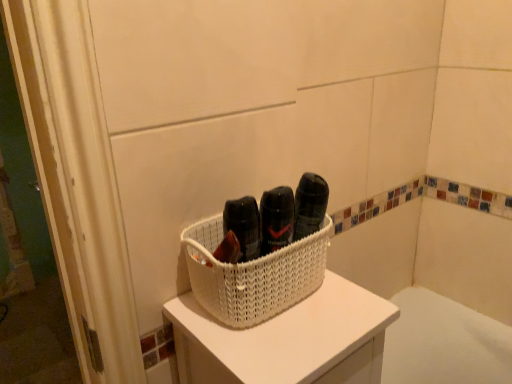
The height and width of the screenshot is (384, 512). What are the coordinates of `white woven basket at center` in the screenshot? It's located at (287, 340).

Describe the element at coordinates (287, 340) in the screenshot. I see `white woven basket at center` at that location.

Measure the distance between white woven basket at center and camera.

white woven basket at center and camera are 20.63 inches apart.

This screenshot has height=384, width=512. Identify the location of white woven basket at center. (253, 274).

Image resolution: width=512 pixels, height=384 pixels. Describe the element at coordinates (253, 274) in the screenshot. I see `white woven basket at center` at that location.

Find the location of a particular element. The width and height of the screenshot is (512, 384). white woven basket at center is located at coordinates (287, 340).

Is white woven basket at center to the right of white woven basket at center from the viewer's perspective?

Correct, you'll find white woven basket at center to the right of white woven basket at center.

Which object is more forward, white woven basket at center or white woven basket at center?

white woven basket at center is closer to the camera.

Which is in front, point (265, 359) or point (231, 270)?

Point (265, 359)

From the image's perspective, relative to white woven basket at center, is white woven basket at center above or below?

Clearly, from the image's perspective, white woven basket at center is below white woven basket at center.

Based on the photo, from a real-world perspective, does white woven basket at center stand above white woven basket at center?

Actually, white woven basket at center is physically below white woven basket at center in the real world.

Is white woven basket at center thinner than white woven basket at center?

No.

From the picture: Does white woven basket at center have a lesser height compared to white woven basket at center?

Incorrect, the height of white woven basket at center does not fall short of that of white woven basket at center.

Based on their sizes in the image, would you say white woven basket at center is bigger or smaller than white woven basket at center?

In the image, white woven basket at center appears to be larger than white woven basket at center.

Does white woven basket at center contain white woven basket at center?

No.

Is white woven basket at center with white woven basket at center?

Yes, white woven basket at center is in contact with white woven basket at center.

Based on the photo, is white woven basket at center oriented away from white woven basket at center?

white woven basket at center does not have its back to white woven basket at center.

Find the location of a particular element. The image size is (512, 384). furniture that appears below the white woven basket at center (from a real-world perspective) is located at coordinates (287, 340).

Can you confirm if white woven basket at center is positioned to the right of white woven basket at center?

No.

Relative to white woven basket at center, is white woven basket at center in front or behind?

white woven basket at center is behind white woven basket at center.

Which is nearer, (223,304) or (185,341)?

Point (223,304)

Consider the image. From the image's perspective, is white woven basket at center below white woven basket at center?

No, from the image's perspective, white woven basket at center is not below white woven basket at center.

From a real-world perspective, is white woven basket at center on white woven basket at center?

Yes.

Consider the image. Considering the sizes of objects white woven basket at center and white woven basket at center in the image provided, who is wider, white woven basket at center or white woven basket at center?

white woven basket at center is wider.

Is white woven basket at center shorter than white woven basket at center?

Indeed, white woven basket at center has a lesser height compared to white woven basket at center.

Considering the sizes of white woven basket at center and white woven basket at center in the image, is white woven basket at center bigger or smaller than white woven basket at center?

Clearly, white woven basket at center is smaller in size than white woven basket at center.

From the picture: Is white woven basket at center not within white woven basket at center?

white woven basket at center lies outside white woven basket at center's area.

Consider the image. Are white woven basket at center and white woven basket at center located far from each other?

They are positioned close to each other.

Is white woven basket at center turned away from white woven basket at center?

No, white woven basket at center is not at the back of white woven basket at center.

Measure the distance from white woven basket at center to white woven basket at center.

7.27 centimeters.

Locate an element on the screen. The width and height of the screenshot is (512, 384). furniture below the white woven basket at center (from the image's perspective) is located at coordinates (287, 340).

Locate an element on the screen. The image size is (512, 384). basket behind the white woven basket at center is located at coordinates (253, 274).

Locate an element on the screen. Image resolution: width=512 pixels, height=384 pixels. basket that appears above the white woven basket at center (from a real-world perspective) is located at coordinates (253, 274).